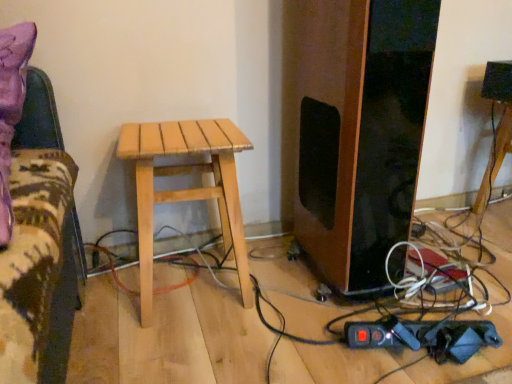
Question: From the image's perspective, is natural wood stool at center positioned above or below wooden stool at center?

Choices:
 (A) below
 (B) above

Answer: (A)

Question: From a real-world perspective, is natural wood stool at center positioned above or below wooden stool at center?

Choices:
 (A) below
 (B) above

Answer: (B)

Question: Is point (221, 178) positioned closer to the camera than point (483, 190)?

Choices:
 (A) farther
 (B) closer

Answer: (B)

Question: Does point tap(479, 200) appear closer or farther from the camera than point tap(202, 162)?

Choices:
 (A) closer
 (B) farther

Answer: (B)

Question: Considering their positions, is wooden stool at center located in front of or behind natural wood stool at center?

Choices:
 (A) behind
 (B) front

Answer: (A)

Question: In the image, is wooden stool at center on the left side or the right side of natural wood stool at center?

Choices:
 (A) right
 (B) left

Answer: (A)

Question: From a real-world perspective, is wooden stool at center physically located above or below natural wood stool at center?

Choices:
 (A) below
 (B) above

Answer: (A)